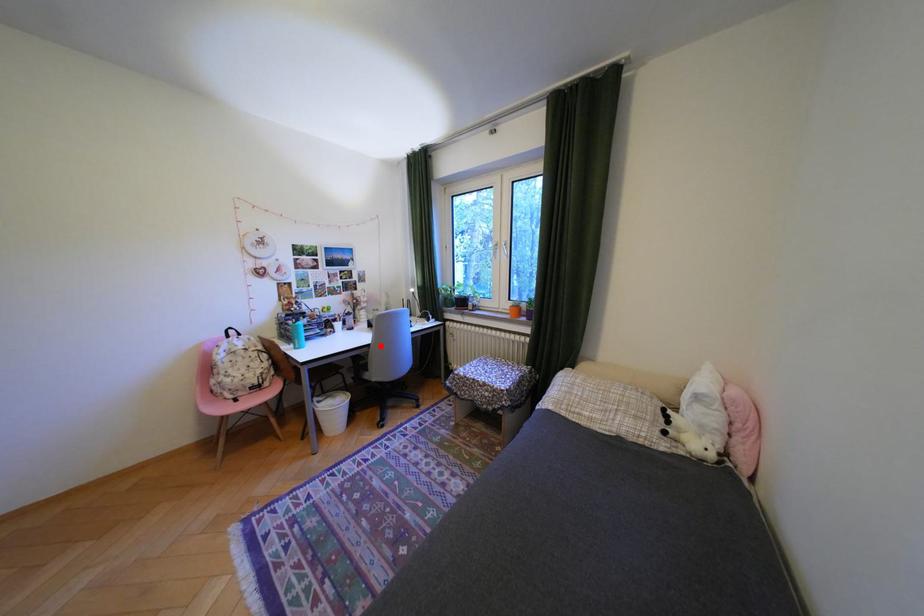
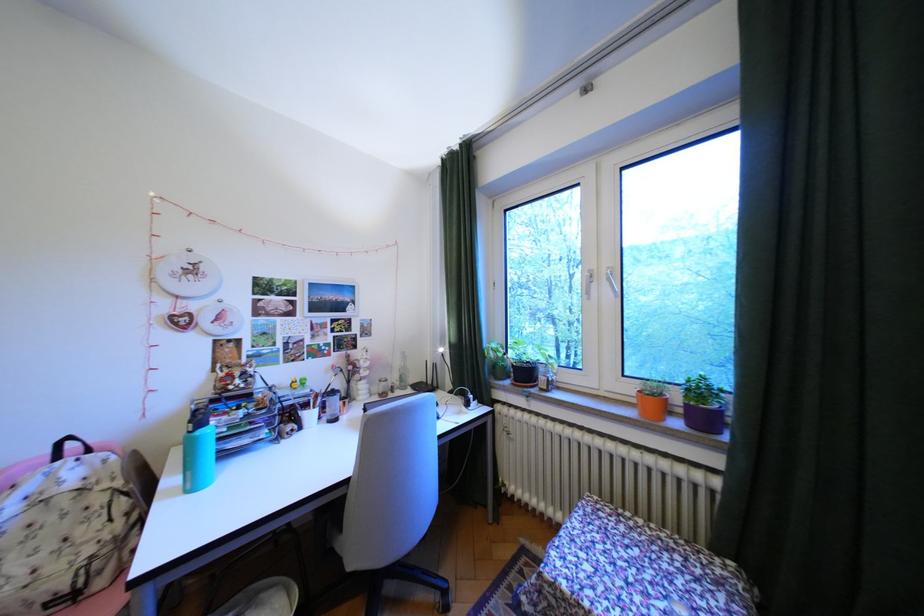
Question: I am providing you with two images of the same scene from different viewpoints. A red point is shown in image1. For the corresponding object point in image2, is it positioned nearer or farther from the camera?

Choices:
 (A) Nearer
 (B) Farther

Answer: (B)